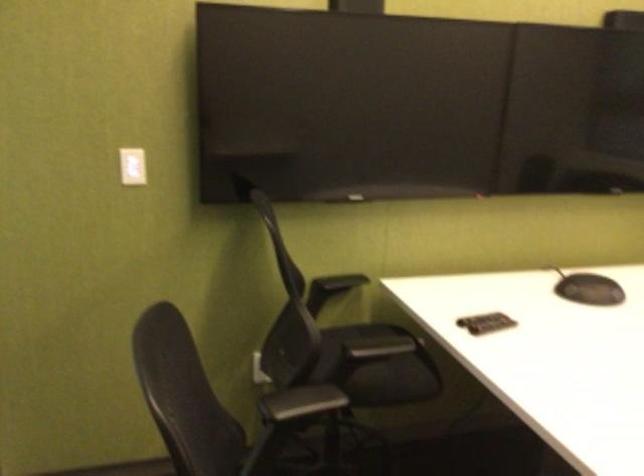
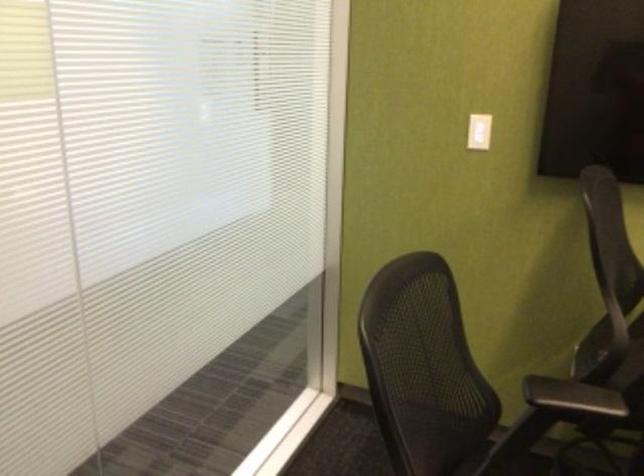
The point at (138,164) is marked in the first image. Where is the corresponding point in the second image?

(478, 131)